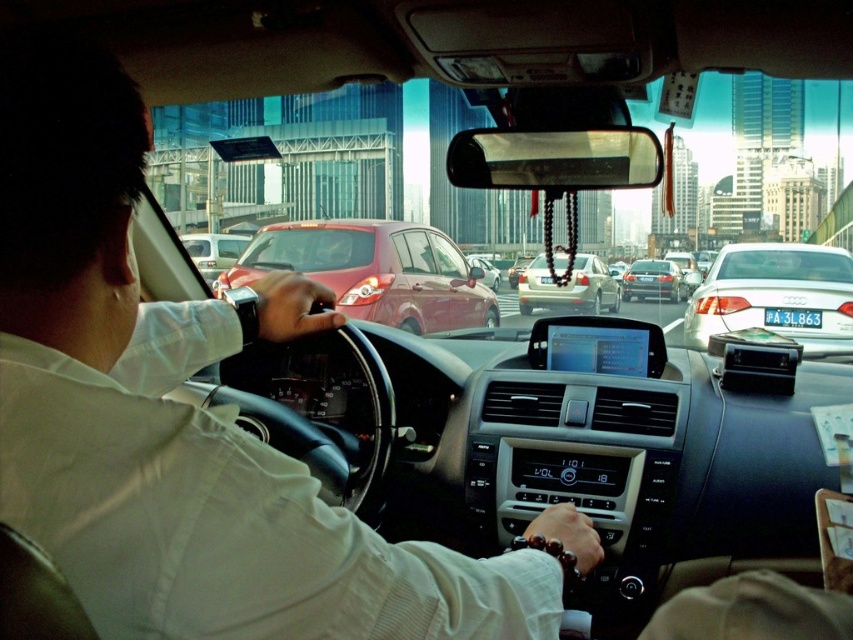
Question: Which is nearer to the metallic silver sedan at center?

Choices:
 (A) glossy red car at center
 (B) white shirt at center
 (C) satin black sedan at center
 (D) silver metallic sedan at right

Answer: (C)

Question: Is white shirt at center to the left of matte white van at center from the viewer's perspective?

Choices:
 (A) no
 (B) yes

Answer: (A)

Question: Can you confirm if silver metallic sedan at right is wider than metallic silver sedan at center?

Choices:
 (A) no
 (B) yes

Answer: (A)

Question: Which of the following is the farthest from the observer?

Choices:
 (A) (485, 264)
 (B) (241, 236)
 (C) (637, 284)
 (D) (547, 284)

Answer: (A)

Question: Which object is the closest to the matte white van at center?

Choices:
 (A) glossy red car at center
 (B) silver metallic sedan at right
 (C) white shirt at center

Answer: (A)

Question: Can you confirm if white shirt at center is positioned below satin black sedan at center?

Choices:
 (A) no
 (B) yes

Answer: (B)